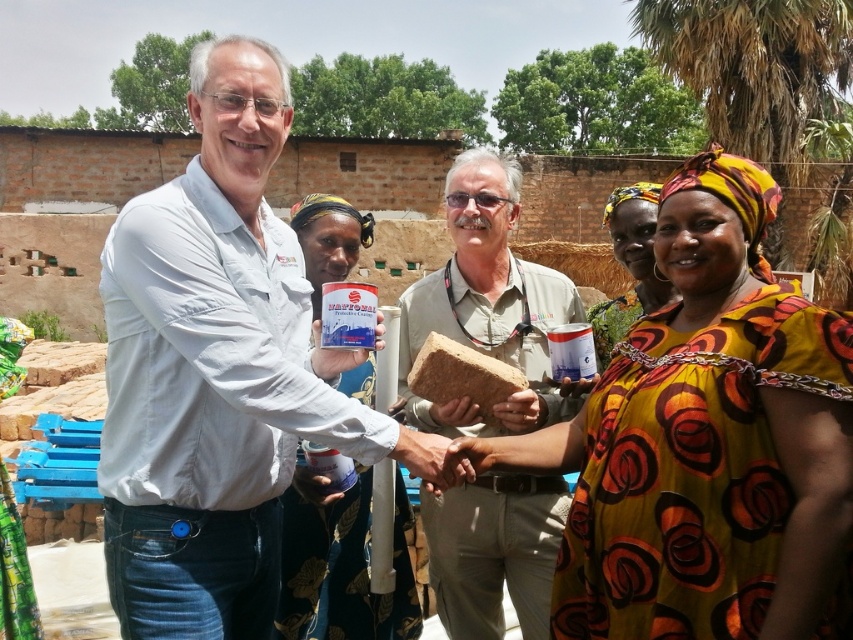
Question: Which object is farther from the camera taking this photo?

Choices:
 (A) smooth brown stone at center
 (B) white matte shirt at center
 (C) smooth skin hand at center

Answer: (A)

Question: Among these points, which one is farthest from the camera?

Choices:
 (A) (300, 582)
 (B) (468, 554)

Answer: (B)

Question: Which object is positioned farthest from the white matte shirt at center?

Choices:
 (A) matte plastic container at center
 (B) smooth brown stone at center
 (C) beige fabric shirt at center
 (D) yellow printed fabric at center

Answer: (D)

Question: Is yellow printed fabric at center below matte plastic container at center?

Choices:
 (A) yes
 (B) no

Answer: (B)

Question: Does white matte shirt at center appear on the left side of matte plastic container at center?

Choices:
 (A) yes
 (B) no

Answer: (A)

Question: Does white matte shirt at center have a greater width compared to beige fabric shirt at center?

Choices:
 (A) yes
 (B) no

Answer: (A)